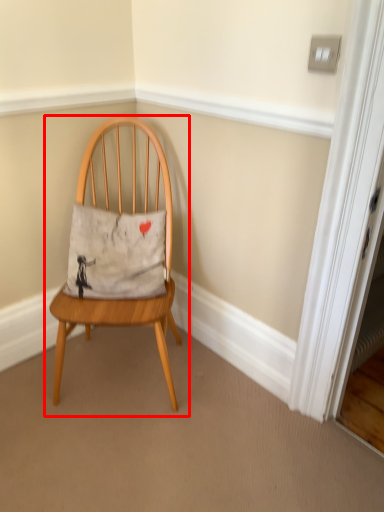
Question: Where is chair (annotated by the red box) located in relation to pillow in the image?

Choices:
 (A) right
 (B) left

Answer: (A)